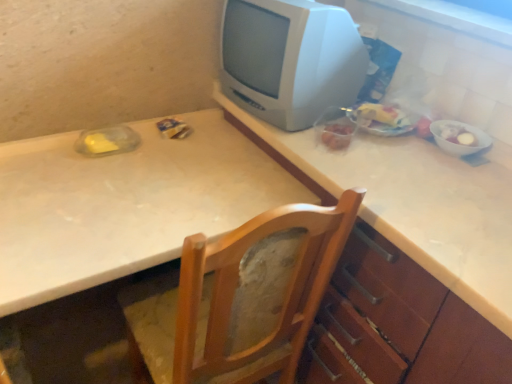
You are a GUI agent. You are given a task and a screenshot of the screen. Output one action in this format:
    pyautogui.click(x=<x>, y=<y>)
    Task: Click on the free space above white glossy counter top at upper center (from a real-world perspective)
    The width and height of the screenshot is (512, 384).
    Given the screenshot: What is the action you would take?
    pyautogui.click(x=409, y=167)